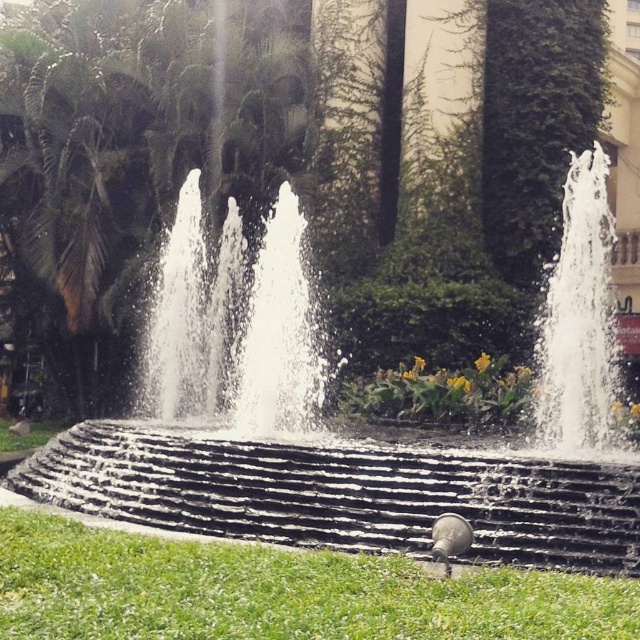
Question: Can you confirm if black stone fountain at center is smaller than clear glass water at upper right?

Choices:
 (A) no
 (B) yes

Answer: (A)

Question: Estimate the real-world distances between objects in this image. Which object is farther from the green grass at lower center?

Choices:
 (A) black stone fountain at center
 (B) clear glass water at upper right

Answer: (B)

Question: Can you confirm if green grass at lower center is positioned below clear glass water at upper right?

Choices:
 (A) no
 (B) yes

Answer: (B)

Question: Which object is closer to the camera taking this photo?

Choices:
 (A) black stone fountain at center
 (B) clear glass water at upper right

Answer: (A)

Question: Which object is positioned closest to the black stone fountain at center?

Choices:
 (A) green grass at lower center
 (B) clear glass water at upper right

Answer: (A)

Question: Is black stone fountain at center positioned at the back of green grass at lower center?

Choices:
 (A) no
 (B) yes

Answer: (B)